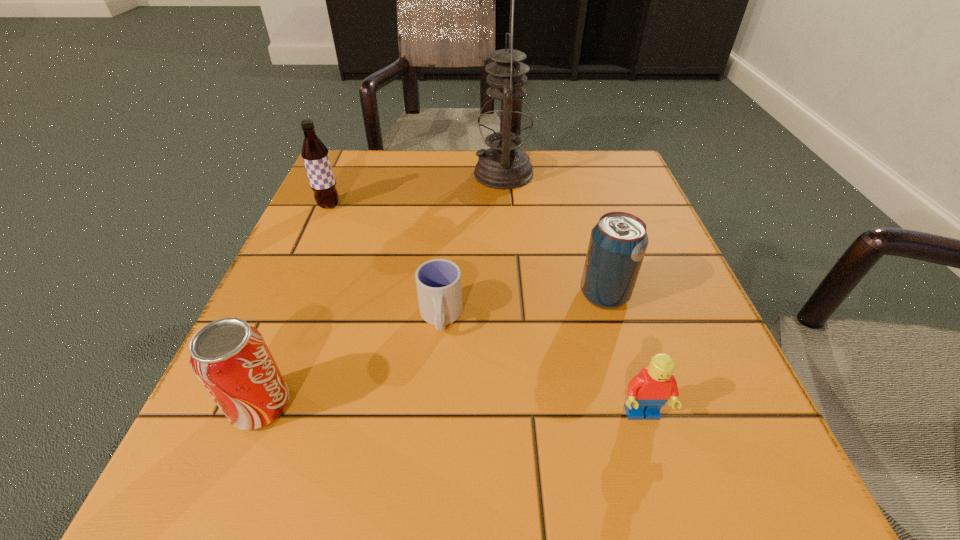
This screenshot has width=960, height=540. In order to click on the fourth object from left to right in this screenshot , I will do `click(505, 121)`.

At what (x,y) coordinates should I click in order to perform the action: click on the tallest object. Please return your answer as a coordinate pair (x, y). The height and width of the screenshot is (540, 960). Looking at the image, I should click on (505, 121).

You are a GUI agent. You are given a task and a screenshot of the screen. Output one action in this format:
    pyautogui.click(x=<x>, y=<y>)
    Task: Click on the fifth shortest object
    The width and height of the screenshot is (960, 540).
    Given the screenshot: What is the action you would take?
    pyautogui.click(x=315, y=155)

Locate an element on the screen. root beer is located at coordinates (315, 155).

I want to click on the farther soda can, so click(618, 242).

Image resolution: width=960 pixels, height=540 pixels. What are the coordinates of `the nearer soda can` in the screenshot? It's located at (231, 358).

The image size is (960, 540). I want to click on Lego, so click(x=648, y=391).

Identify the location of the shortest object. Image resolution: width=960 pixels, height=540 pixels. tap(438, 281).

Locate an element on the screen. The height and width of the screenshot is (540, 960). the third object from left to right is located at coordinates (438, 281).

Locate an element on the screen. Image resolution: width=960 pixels, height=540 pixels. blank space located 0.130m on the right of the oil lamp is located at coordinates (589, 174).